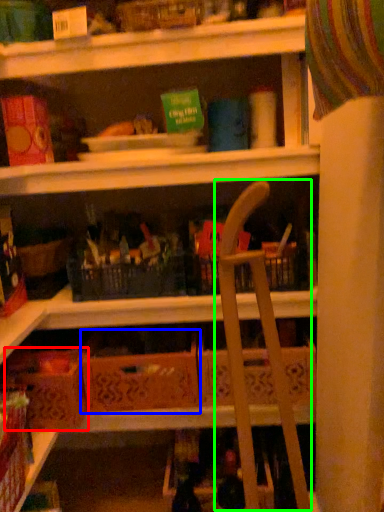
Question: Which is nearer to the cardboard box (highlighted by a red box)? cardboard box (highlighted by a blue box) or folding chair (highlighted by a green box).

Choices:
 (A) cardboard box
 (B) folding chair

Answer: (A)